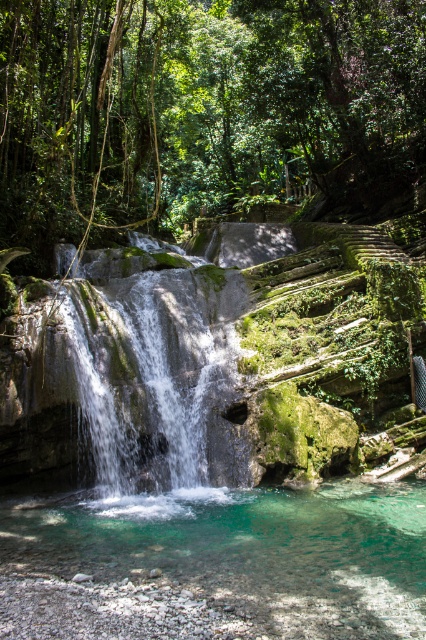
Question: Estimate the real-world distances between objects in this image. Which object is farther from the clear glass water at center?

Choices:
 (A) green mossy rocks at center
 (B) green mossy waterfall at center

Answer: (A)

Question: Is green mossy rocks at center wider than green mossy waterfall at center?

Choices:
 (A) yes
 (B) no

Answer: (A)

Question: Which point appears farthest from the camera in this image?

Choices:
 (A) (149, 300)
 (B) (176, 51)

Answer: (B)

Question: Among these points, which one is farthest from the camera?

Choices:
 (A) (232, 353)
 (B) (290, 572)
 (C) (158, 76)

Answer: (C)

Question: Does green mossy rocks at center have a lesser width compared to green mossy waterfall at center?

Choices:
 (A) yes
 (B) no

Answer: (B)

Question: Can you confirm if green mossy rocks at center is positioned to the right of clear glass water at center?

Choices:
 (A) yes
 (B) no

Answer: (A)